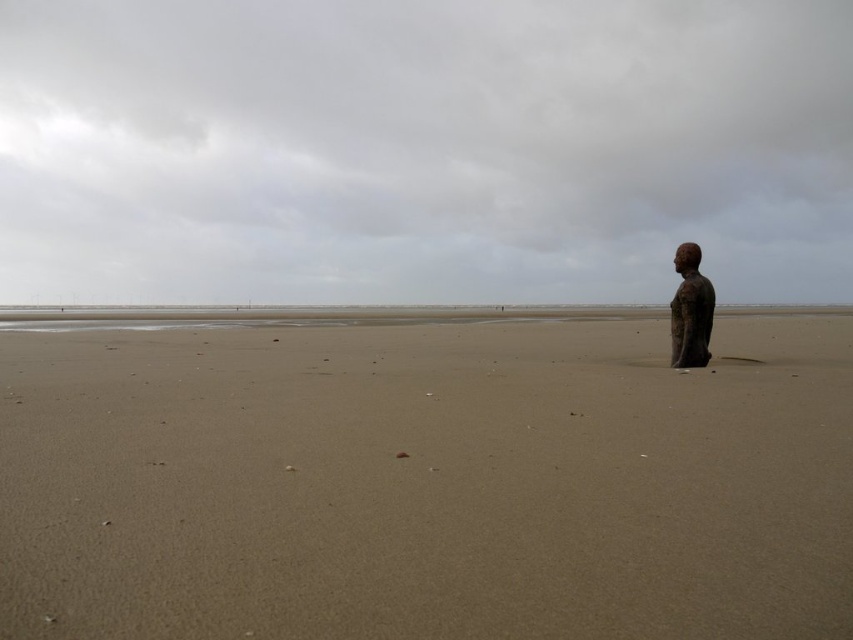
Question: Is matte metallic statue at right above bronze statue at right?

Choices:
 (A) no
 (B) yes

Answer: (B)

Question: Can you confirm if smooth sand at lower right is smaller than matte metallic statue at right?

Choices:
 (A) yes
 (B) no

Answer: (A)

Question: Which point is farther to the camera?

Choices:
 (A) (677, 248)
 (B) (567, 410)
 (C) (634, 291)

Answer: (C)

Question: Which object is farther from the camera taking this photo?

Choices:
 (A) matte metallic statue at right
 (B) bronze statue at right

Answer: (B)

Question: Can you confirm if smooth sand at lower right is thinner than matte metallic statue at right?

Choices:
 (A) yes
 (B) no

Answer: (A)

Question: Which point appears closest to the camera in this image?

Choices:
 (A) (236, 148)
 (B) (802, 548)

Answer: (B)